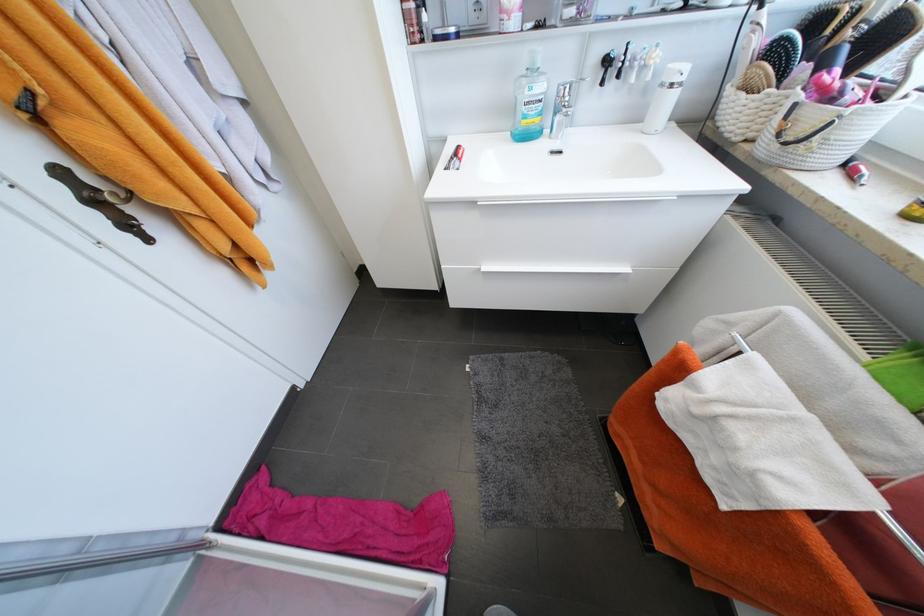
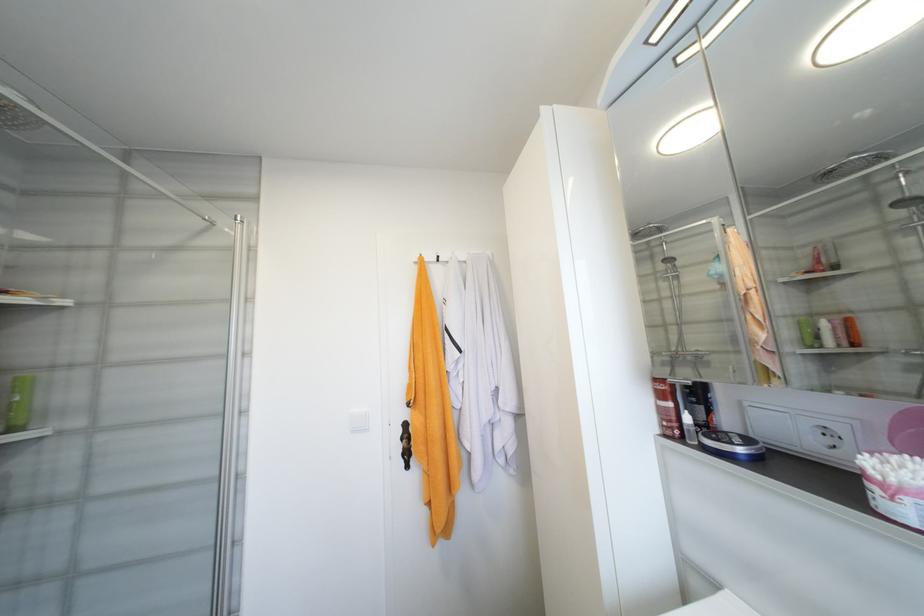
In the second image, find the point that corresponds to (x=103, y=220) in the first image.

(405, 448)